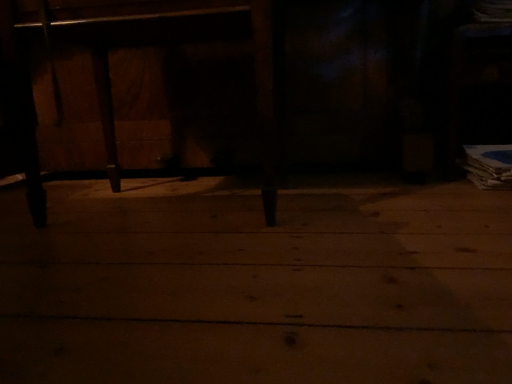
Where is `free spot in front of wooden table at center`? The height and width of the screenshot is (384, 512). free spot in front of wooden table at center is located at coordinates (269, 257).